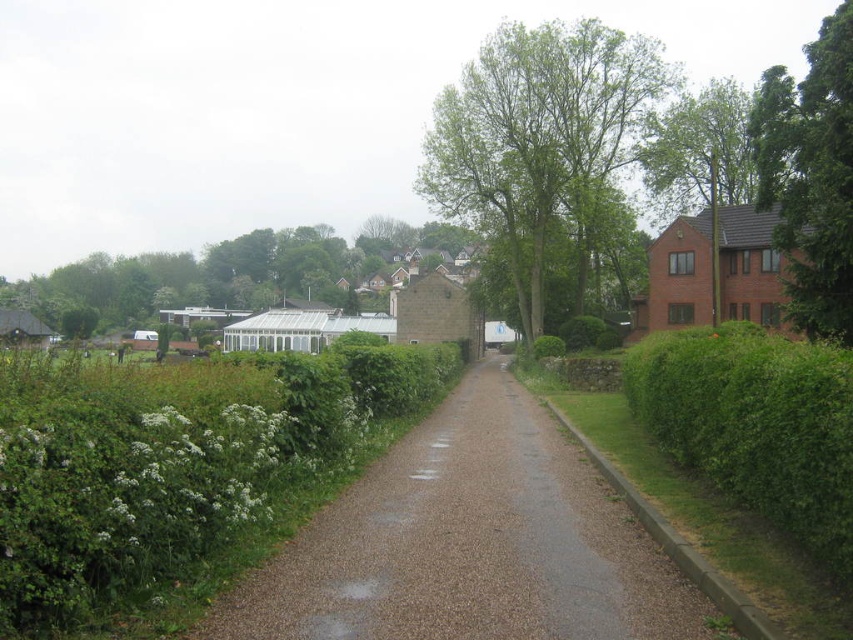
Where is `green leafy hedge at right`? green leafy hedge at right is located at coordinates (756, 426).

Describe the element at coordinates (756, 426) in the screenshot. I see `green leafy hedge at right` at that location.

Is point (830, 484) farther from viewer compared to point (814, 141)?

That is False.

The width and height of the screenshot is (853, 640). I want to click on green leafy hedge at right, so click(x=756, y=426).

Does green leafy tree at right appear on the left side of green leafy tree at upper right?

Indeed, green leafy tree at right is positioned on the left side of green leafy tree at upper right.

Who is more distant from viewer, (843, 204) or (740, 192)?

Point (740, 192)

Locate an element on the screen. The image size is (853, 640). green leafy tree at right is located at coordinates (811, 176).

Who is lower down, brown gravel driveway at center or green leafy hedge at center?

brown gravel driveway at center

Consider the image. Is brown gravel driveway at center to the right of green leafy hedge at center from the viewer's perspective?

Yes, brown gravel driveway at center is to the right of green leafy hedge at center.

Is point (524, 556) farther from viewer compared to point (30, 486)?

Yes, point (524, 556) is behind point (30, 486).

Locate an element on the screen. brown gravel driveway at center is located at coordinates (469, 541).